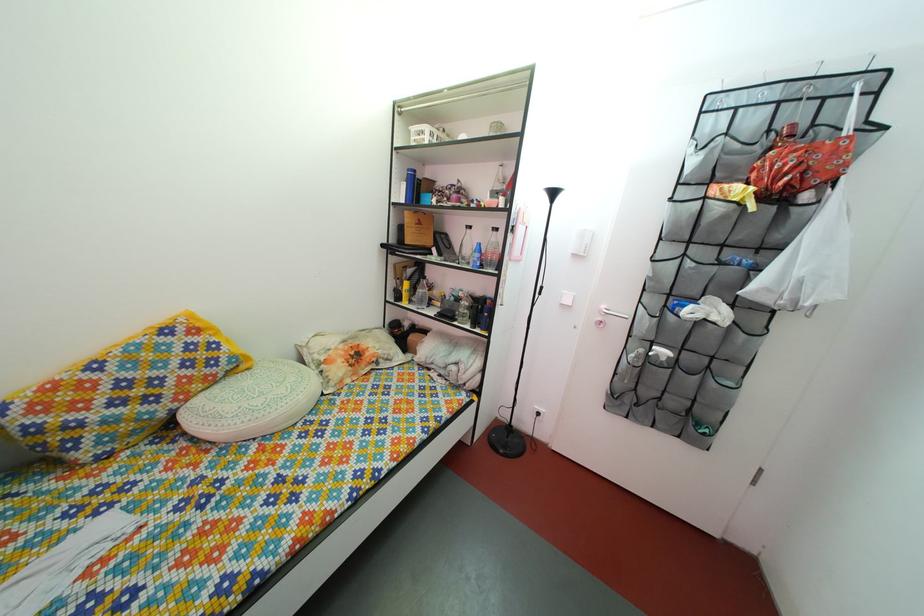
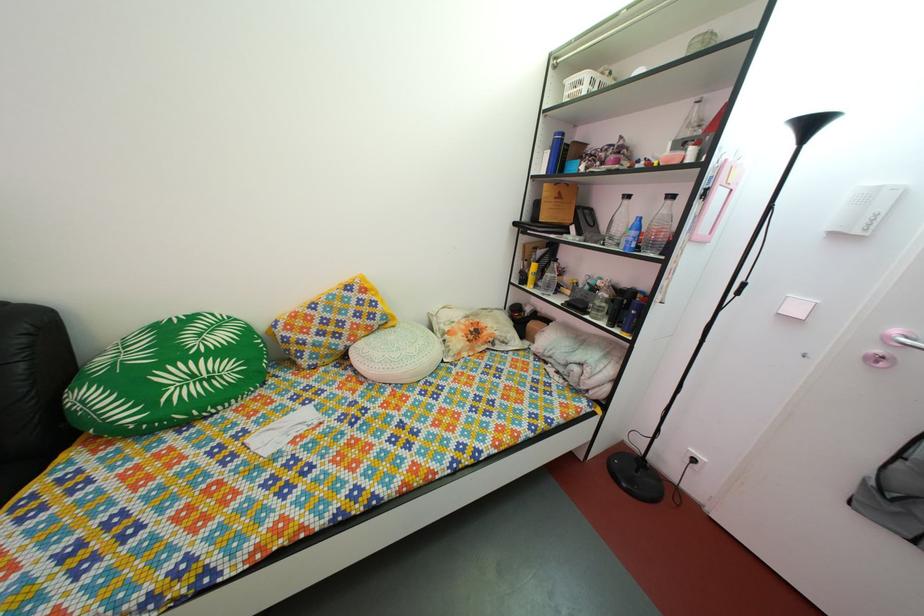
Find the pixel in the second image that matches (x=506, y=190) in the first image.

(697, 136)